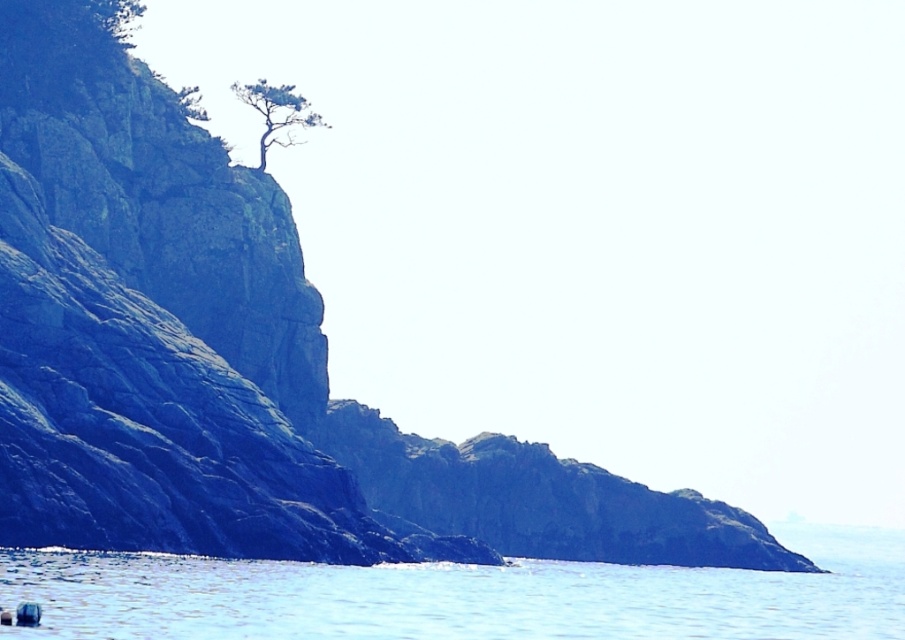
Does point (289, 93) come in front of point (138, 22)?

No, it is not.

Does point (273, 90) come in front of point (118, 26)?

No, it is not.

You are a GUI agent. You are given a task and a screenshot of the screen. Output one action in this format:
    pyautogui.click(x=<x>, y=<y>)
    Task: Click on the green textured tree at upper left
    
    Given the screenshot: What is the action you would take?
    pyautogui.click(x=277, y=113)

Who is more distant from viewer, (769, 576) or (135, 26)?

Positioned behind is point (769, 576).

Does blue water at center appear under green leafy tree at upper left?

Indeed, blue water at center is positioned under green leafy tree at upper left.

The height and width of the screenshot is (640, 905). Find the location of `blue water at center`. blue water at center is located at coordinates (463, 595).

In order to click on blue water at center in this screenshot , I will do (x=463, y=595).

Can you confirm if blue water at center is positioned to the left of green textured tree at upper left?

No, blue water at center is not to the left of green textured tree at upper left.

Find the location of a particular element. blue water at center is located at coordinates (463, 595).